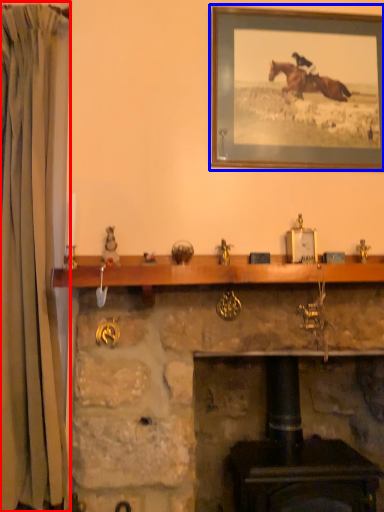
Question: Which object appears closest to the camera in this image, curtain (highlighted by a red box) or picture frame (highlighted by a blue box)?

Choices:
 (A) curtain
 (B) picture frame

Answer: (A)